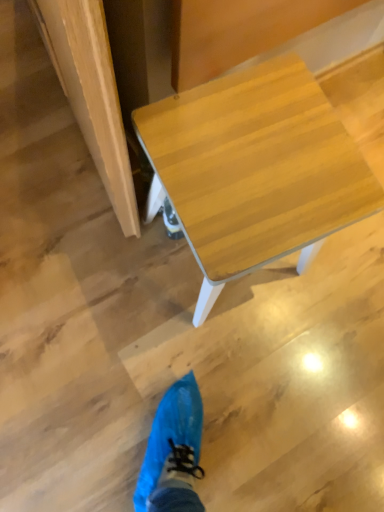
Locate an element on the screen. vacant space situated on the left part of light wood table at center is located at coordinates (92, 257).